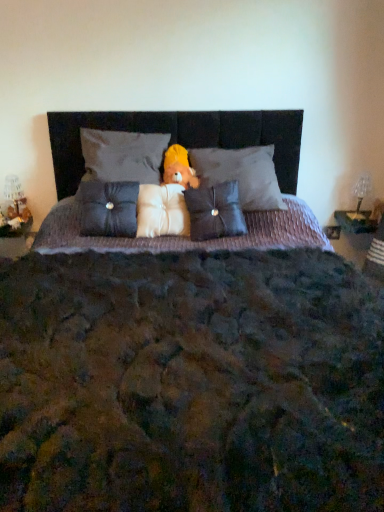
Question: Based on their positions, is white plush pillow at center, placed as the third pillow when sorted from right to left, located to the left or right of clear glass table lamp at right?

Choices:
 (A) left
 (B) right

Answer: (A)

Question: Is point (157, 225) closer or farther from the camera than point (365, 178)?

Choices:
 (A) closer
 (B) farther

Answer: (A)

Question: Estimate the real-world distances between objects in this image. Which object is farther from the velvet gray pillow at center, positioned as the 1th pillow in right-to-left order?

Choices:
 (A) clear glass table lamp at right
 (B) satin dark gray pillow at center, arranged as the 2th pillow when viewed from the right
 (C) yellow plush bear at center
 (D) velvet gray pillow at upper center, which ranks as the 4th pillow in right-to-left order
 (E) white plush pillow at center, placed as the third pillow when sorted from left to right

Answer: (A)

Question: Estimate the real-world distances between objects in this image. Which object is closer to the yellow plush bear at center?

Choices:
 (A) velvet gray pillow at upper center, positioned as the 2th pillow in left-to-right order
 (B) white plush pillow at center, placed as the third pillow when sorted from left to right
 (C) satin dark gray pillow at center, arranged as the 2th pillow when viewed from the right
 (D) velvet gray pillow at center, the 5th pillow when ordered from left to right
 (E) clear glass table lamp at right

Answer: (A)